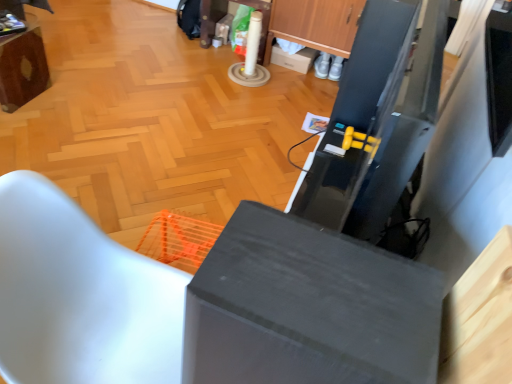
The width and height of the screenshot is (512, 384). I want to click on free space in front of white cardboard box at center, so click(297, 81).